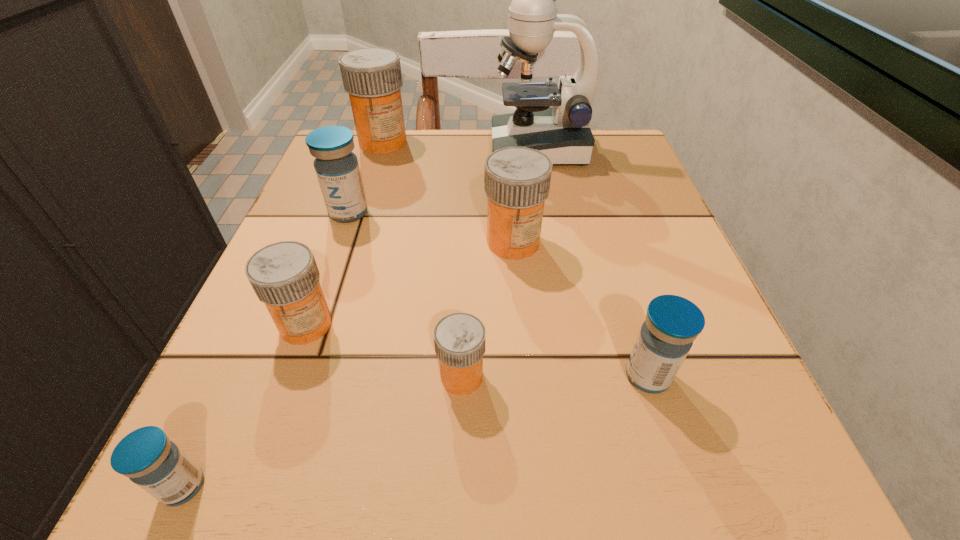
Locate an element on the screen. medicine that is the second closest one to the second orange medicine from right to left is located at coordinates (672, 323).

Locate which orange medicine ranks in proximity to the second medicine from right to left. Please provide its 2D coordinates. Your answer should be formatted as a tuple, i.e. [(x, y)], where the tuple contains the x and y coordinates of a point satisfying the conditions above.

[(459, 338)]

The image size is (960, 540). In order to click on the closest orange medicine to the third farthest orange medicine in this screenshot , I will do `click(459, 338)`.

Identify the location of blue medicine object that ranks as the second closest to the biggest orange medicine. (672, 323).

Where is `the second closest blue medicine to the second smallest blue medicine`? This screenshot has width=960, height=540. the second closest blue medicine to the second smallest blue medicine is located at coordinates (157, 465).

I want to click on vacant region that satisfies the following two spatial constraints: 1. at the eyepiece of the microscope; 2. on the label side of the second medicine from right to left, so click(x=557, y=242).

This screenshot has width=960, height=540. What are the coordinates of `vacant space that satisfies the following two spatial constraints: 1. on the label side of the second medicine from right to left; 2. on the right side of the second smallest blue medicine` in the screenshot? It's located at (524, 376).

Where is `blank space that satisfies the following two spatial constraints: 1. at the eyepiece of the microscope; 2. on the label side of the third smallest orange medicine`? The width and height of the screenshot is (960, 540). blank space that satisfies the following two spatial constraints: 1. at the eyepiece of the microscope; 2. on the label side of the third smallest orange medicine is located at coordinates coord(557,242).

Where is `vacant area that satisfies the following two spatial constraints: 1. on the label side of the nearest orange medicine; 2. on the front side of the leftmost blue medicine`? This screenshot has width=960, height=540. vacant area that satisfies the following two spatial constraints: 1. on the label side of the nearest orange medicine; 2. on the front side of the leftmost blue medicine is located at coordinates (458, 487).

Identify the location of blank area in the image that satisfies the following two spatial constraints: 1. on the label side of the second biggest orange medicine; 2. on the label side of the fourth object from right to left. (524, 377).